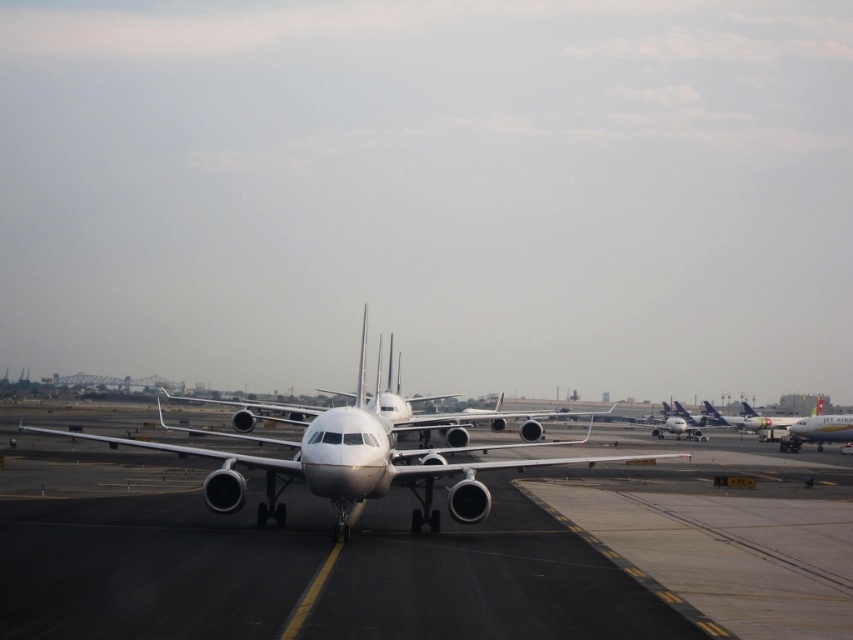
You are standing at the airport and see two points marked on the tarmac. The first point is at coordinates point (331, 611) and the second point is at point (341, 445). Which point is closer to you?

Point (331, 611) is closer to the viewer than point (341, 445).

You are a pilot who needs to park the white matte airplane at center on the white glossy tarmac at center. Based on the scene, will the airplane fit on the tarmac without overhanging the edges?

The white glossy tarmac at center has a larger width than the white matte airplane at center, so the airplane will fit without overhanging the edges.

You are a pilot who just landed the plane and need to check the runway markings. Where is the white glossy tarmac at center located in terms of coordinates?

The white glossy tarmac at center is located at coordinates point (428, 554).